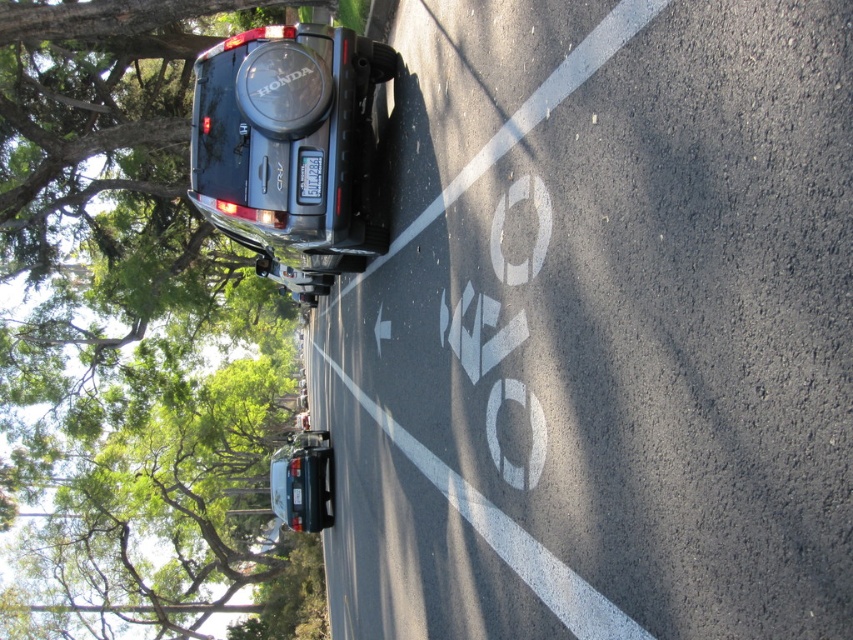
You are a cyclist approaching the white asphalt bike lane at upper center and the shiny silver sedan at center. Which object is nearer to you as you ride towards the road?

The white asphalt bike lane at upper center is closer to the viewer than the shiny silver sedan at center, so the bike lane is nearer to you as you ride towards the road.

Consider the image. You are a delivery driver who needs to park your vehicle between two other cars. The shiny silver sedan at center and the white plastic license plate at center are already parked. Which one should you avoid if you want to park closer to the road edge?

The shiny silver sedan at center might be wider than the white plastic license plate at center, so you should avoid parking next to the shiny silver sedan at center to stay closer to the road edge.